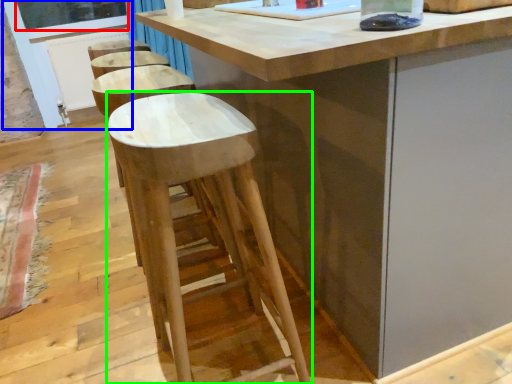
Question: Estimate the real-world distances between objects in this image. Which object is closer to window screen (highlighted by a red box), screen door (highlighted by a blue box) or stool (highlighted by a green box)?

Choices:
 (A) screen door
 (B) stool

Answer: (A)